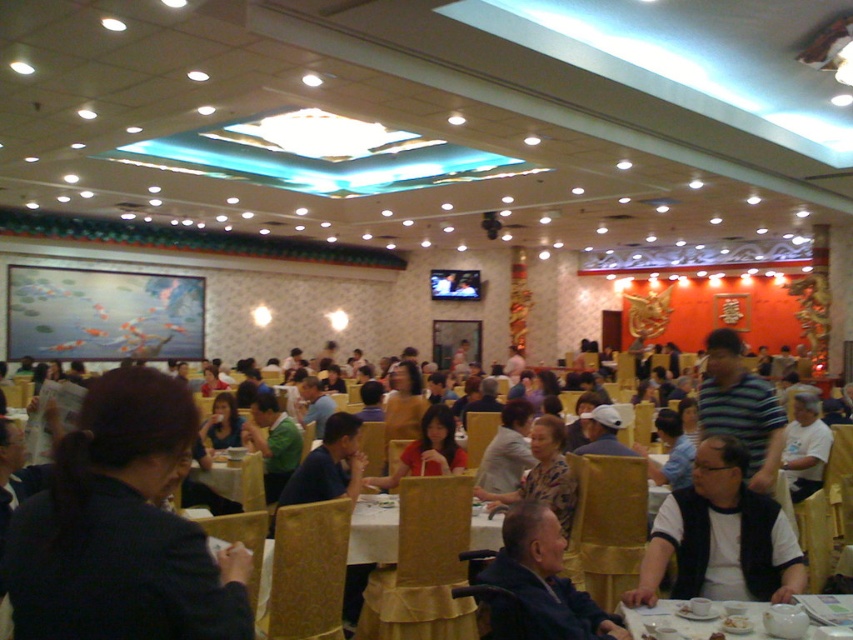
Question: Observing the image, what is the correct spatial positioning of dark blue fabric at lower center in reference to white matte shirt at center?

Choices:
 (A) above
 (B) below

Answer: (B)

Question: Is dark blue fabric at lower center to the left of wooden table at center from the viewer's perspective?

Choices:
 (A) no
 (B) yes

Answer: (A)

Question: Where is white matte vest at center located in relation to white matte shirt at center in the image?

Choices:
 (A) left
 (B) right

Answer: (A)

Question: Considering the real-world distances, which object is farthest from the dark blue fabric at lower center?

Choices:
 (A) white matte shirt at center
 (B) white matte vest at center

Answer: (A)

Question: Which point is closer to the camera?

Choices:
 (A) white matte vest at center
 (B) dark blue fabric at lower center
 (C) white matte shirt at center

Answer: (B)

Question: Based on their relative distances, which object is farther from the wooden table at center?

Choices:
 (A) dark blue shirt at center
 (B) white matte shirt at center

Answer: (B)